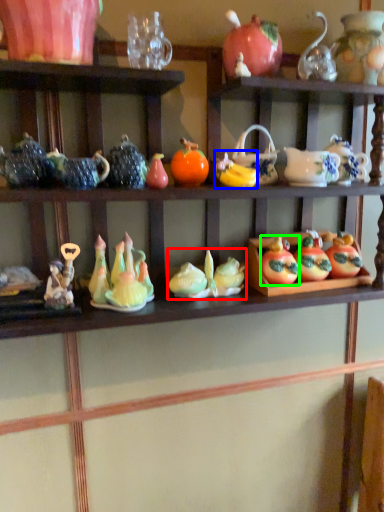
Question: Estimate the real-world distances between objects in this image. Which object is closer to toy (highlighted by a red box), fruit (highlighted by a blue box) or fruit (highlighted by a green box)?

Choices:
 (A) fruit
 (B) fruit

Answer: (B)